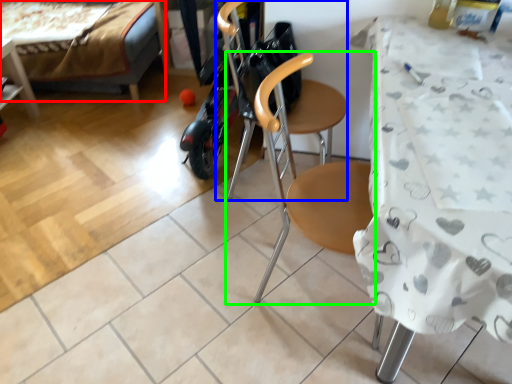
Question: Estimate the real-world distances between objects in this image. Which object is closer to bed (highlighted by a red box), swivel chair (highlighted by a blue box) or chair (highlighted by a green box)?

Choices:
 (A) swivel chair
 (B) chair

Answer: (B)